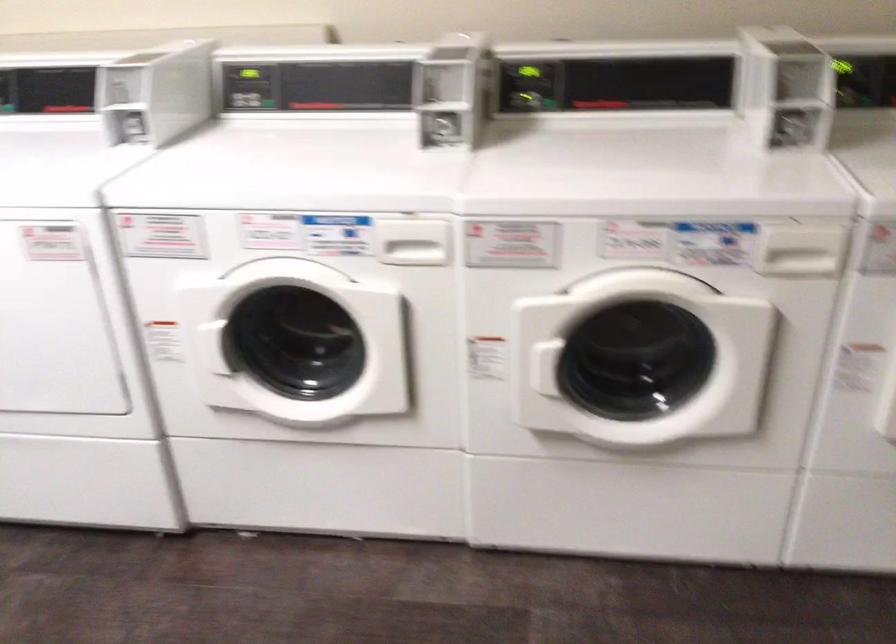
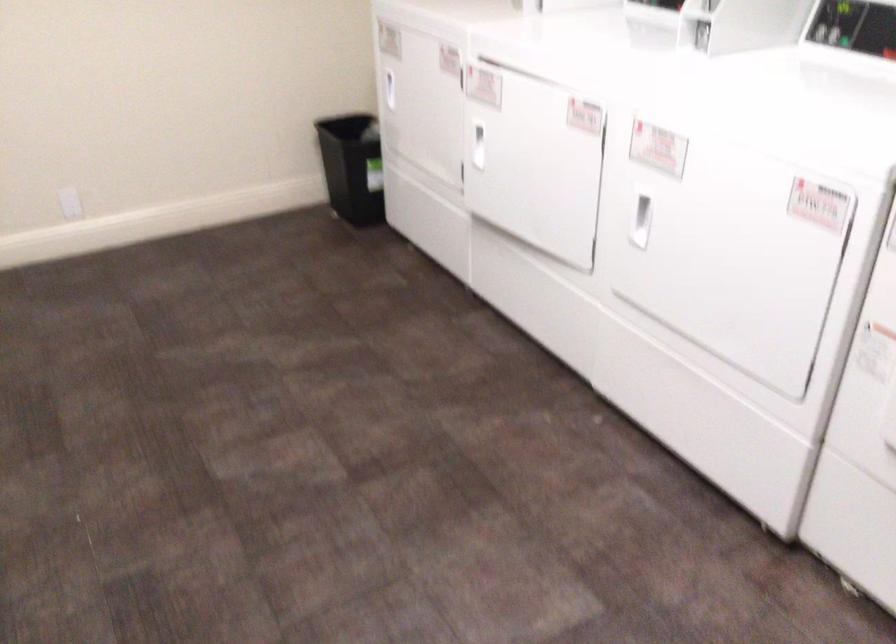
Question: The camera is either moving clockwise (left) or counter-clockwise (right) around the object. The first image is from the beginning of the video and the second image is from the end. Is the camera moving left or right when shooting the video?

Choices:
 (A) Left
 (B) Right

Answer: (B)